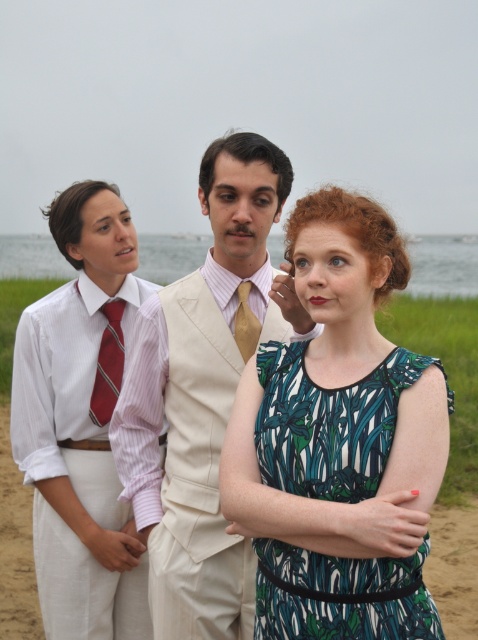
You are a fashion designer observing the scene. You need to determine which item has a greater width between the matte striped shirt at left and the striped silk tie at center. Based on the scene, which one is wider?

The matte striped shirt at left is wider than the striped silk tie at center according to the description.

Based on the photo, you are a photographer setting up for a group photo. You notice the matte striped shirt at left and the gold silk tie at center. Given that your camera has a focal length of 50mm and you want both items to be in focus, what is the minimum distance you should stand from the closest object?

The matte striped shirt at left is 27.63 inches from the gold silk tie at center. To ensure both are in focus with a 50mm lens, the minimum distance from the closest object should be at least 27.63 inches divided by the lens focal length multiplier for depth of field. However, without specific aperture settings, an exact calculation isn photography best practice is to position the camera at a distance where the hyperfocal distance covers both objects. A safe estimate would be to stand about 30 inches away,

Based on the photo, you are a photographer setting up a camera to capture the scene described. You need to ensure that both the light beige vest at center and the gold silk tie at center are clearly visible in the frame. Given their sizes, which object should you focus on first to ensure proper focus, and why?

The light beige vest at center is larger in size than the gold silk tie at center, so focusing on the light beige vest at center first will ensure proper focus since larger objects generally require more precise focusing to capture details clearly.